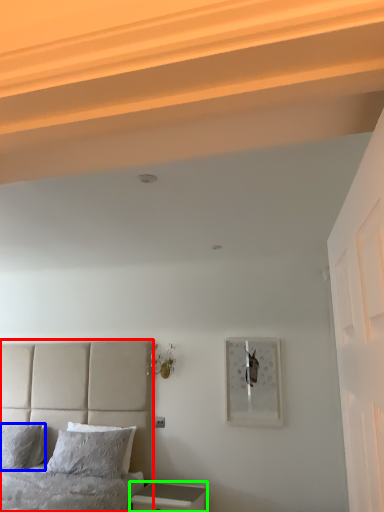
Question: Estimate the real-world distances between objects in this image. Which object is closer to bed (highlighted by a red box), pillow (highlighted by a blue box) or nightstand (highlighted by a green box)?

Choices:
 (A) pillow
 (B) nightstand

Answer: (A)